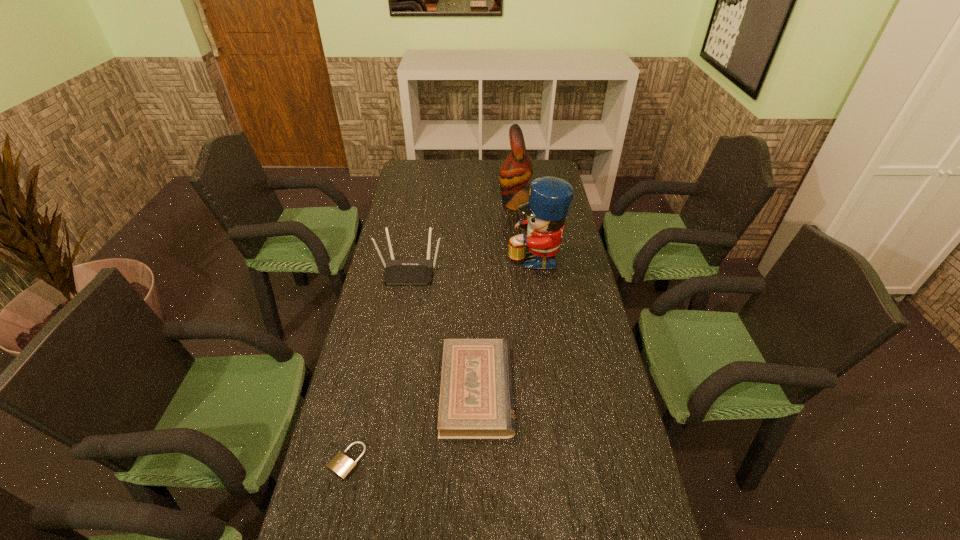
At what (x,y) coordinates should I click in order to perform the action: click on parrot. Please return your answer as a coordinate pair (x, y). Image resolution: width=960 pixels, height=540 pixels. Looking at the image, I should click on (516, 170).

This screenshot has height=540, width=960. In order to click on nutcracker in this screenshot , I will do `click(550, 198)`.

Where is `router`? This screenshot has width=960, height=540. router is located at coordinates (396, 271).

Where is `the fourth farthest object`? the fourth farthest object is located at coordinates (476, 399).

In order to click on Bible in this screenshot , I will do `click(476, 399)`.

At what (x,y) coordinates should I click in order to perform the action: click on the shortest object. Please return your answer as a coordinate pair (x, y). The width and height of the screenshot is (960, 540). Looking at the image, I should click on (341, 465).

At what (x,y) coordinates should I click in order to perform the action: click on the nearest object. Please return your answer as a coordinate pair (x, y). This screenshot has width=960, height=540. Looking at the image, I should click on (341, 465).

The image size is (960, 540). In order to click on vacant space located on the face of the parrot in this screenshot , I will do `click(444, 203)`.

Where is `free space located 0.220m on the face of the parrot`? The height and width of the screenshot is (540, 960). free space located 0.220m on the face of the parrot is located at coordinates (447, 203).

Where is `free space located on the face of the parrot`? This screenshot has height=540, width=960. free space located on the face of the parrot is located at coordinates (421, 203).